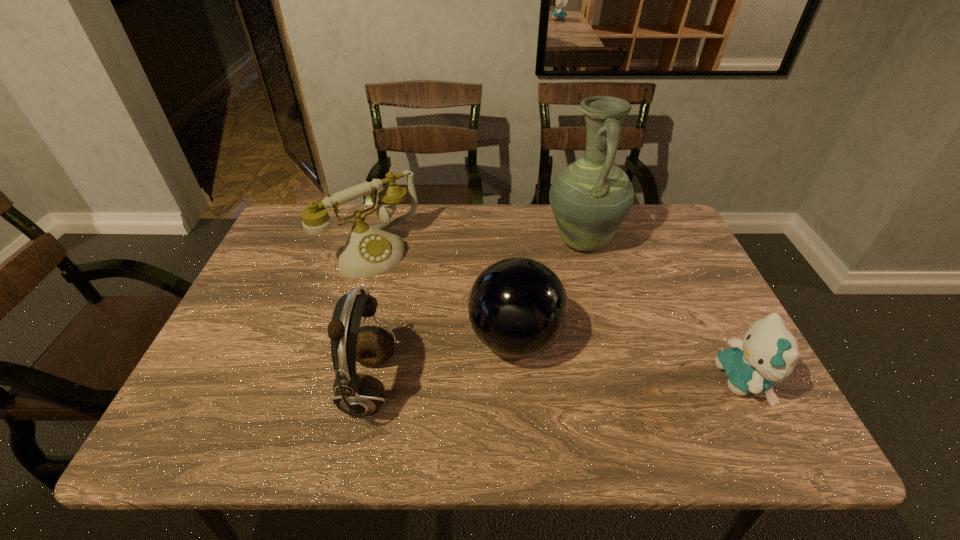
At what (x,y) coordinates should I click in order to perform the action: click on free space at the right edge of the desktop. Please return your answer as a coordinate pair (x, y). The height and width of the screenshot is (540, 960). Looking at the image, I should click on (690, 323).

The image size is (960, 540). I want to click on free region at the far left corner, so click(x=327, y=245).

You are a GUI agent. You are given a task and a screenshot of the screen. Output one action in this format:
    pyautogui.click(x=<x>, y=<y>)
    Task: Click on the free space between the telephone and the tallest object
    
    Given the screenshot: What is the action you would take?
    (x=477, y=245)

Find the location of a particular element. The height and width of the screenshot is (540, 960). free space between the telephone and the second tallest object is located at coordinates (371, 318).

Where is `free area in between the earphone and the telephone`? free area in between the earphone and the telephone is located at coordinates (371, 318).

This screenshot has height=540, width=960. In order to click on unoccupied position between the shortest object and the fourth shortest object in this screenshot , I will do `click(556, 383)`.

Where is `vacant area between the pitcher and the telephone`? This screenshot has width=960, height=540. vacant area between the pitcher and the telephone is located at coordinates (477, 245).

Find the location of a particular element. free space between the pitcher and the telephone is located at coordinates (477, 245).

Select which object is the second closest to the tallest object. Please provide its 2D coordinates. Your answer should be formatted as a tuple, i.e. [(x, y)], where the tuple contains the x and y coordinates of a point satisfying the conditions above.

[(768, 353)]

Identify which object is located as the third nearest to the tallest object. Please provide its 2D coordinates. Your answer should be formatted as a tuple, i.e. [(x, y)], where the tuple contains the x and y coordinates of a point satisfying the conditions above.

[(369, 251)]